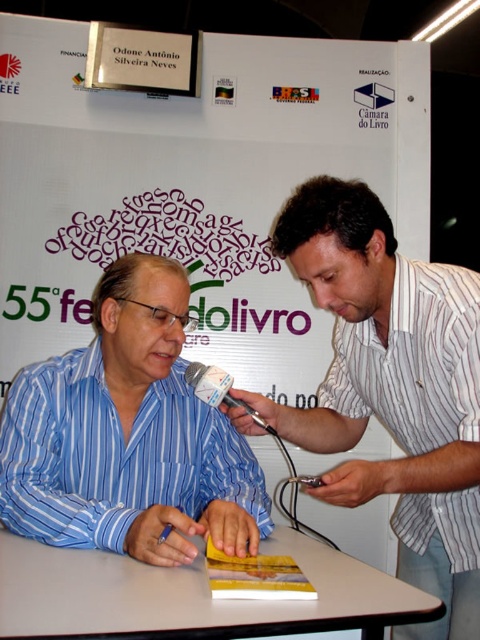
Measure the distance between white striped shirt at center and camera.

white striped shirt at center is 38.82 inches away from camera.

Does white striped shirt at center come behind white striped shirt at right?

No, white striped shirt at center is in front of white striped shirt at right.

Identify the location of white striped shirt at center. The width and height of the screenshot is (480, 640). (393, 388).

Which of these two, white striped shirt at center or blue striped shirt at center, stands taller?

Standing taller between the two is white striped shirt at center.

Does white striped shirt at center have a lesser width compared to blue striped shirt at center?

Correct, white striped shirt at center's width is less than blue striped shirt at center's.

Does point (466, 534) lie in front of point (134, 477)?

That is True.

At what (x,y) coordinates should I click in order to perform the action: click on white striped shirt at center. Please return your answer as a coordinate pair (x, y). Looking at the image, I should click on (393, 388).

Can you confirm if blue striped shirt at center is shorter than white striped shirt at right?

Yes, blue striped shirt at center is shorter than white striped shirt at right.

Is blue striped shirt at center thinner than white striped shirt at right?

In fact, blue striped shirt at center might be wider than white striped shirt at right.

Locate an element on the screen. blue striped shirt at center is located at coordinates (128, 435).